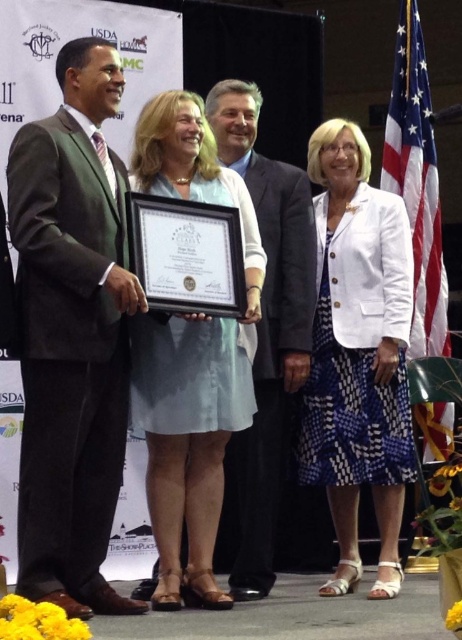
You are an event photographer at the back of the room. You need to capture a photo where the light blue fabric dress at center and the matte black suit at center are both visible. Based on their positions, which one should you position your camera to focus on first to ensure both are in frame?

The light blue fabric dress at center is to the left of matte black suit at center, so you should focus on the matte black suit at center first to ensure both are in frame.

You are a photographer at the event and want to take a photo of the green suit at left and the white textured blazer at center. Since you can only focus on one person at a time, which person should you focus on to ensure the other is still in the background?

The green suit at left is in front of the white textured blazer at center, so you should focus on the green suit at left to have the white textured blazer at center in the background.